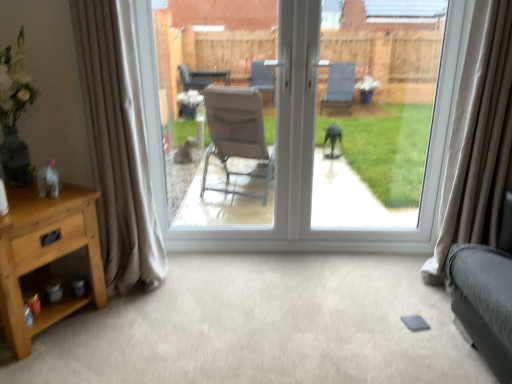
Question: Does point (475, 190) appear closer or farther from the camera than point (249, 228)?

Choices:
 (A) closer
 (B) farther

Answer: (A)

Question: Considering the positions of beige velvet curtain at right, which appears as the first curtain when viewed from the right, and transparent glass door at center in the image, is beige velvet curtain at right, which appears as the first curtain when viewed from the right, bigger or smaller than transparent glass door at center?

Choices:
 (A) small
 (B) big

Answer: (A)

Question: Which is nearer to the transparent glass window at center?

Choices:
 (A) transparent glass door at center
 (B) light brown wood nightstand at lower left
 (C) beige satin curtain at left, which appears as the 2th curtain when viewed from the right
 (D) beige velvet curtain at right, the second curtain in the left-to-right sequence

Answer: (A)

Question: Estimate the real-world distances between objects in this image. Which object is closer to the beige velvet curtain at right, the second curtain in the left-to-right sequence?

Choices:
 (A) transparent glass door at center
 (B) beige satin curtain at left, which appears as the first curtain when viewed from the left
 (C) transparent glass window at center
 (D) light brown wood nightstand at lower left

Answer: (A)